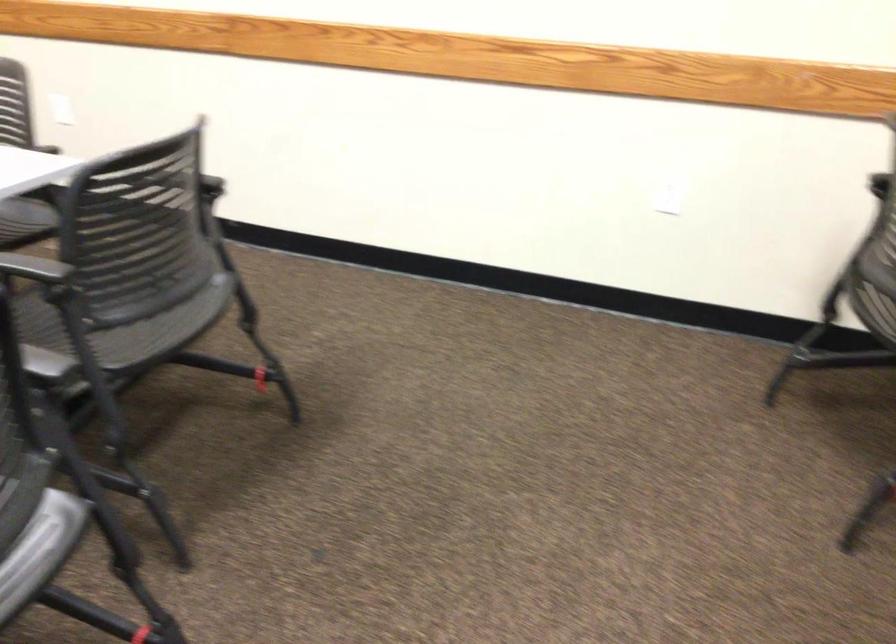
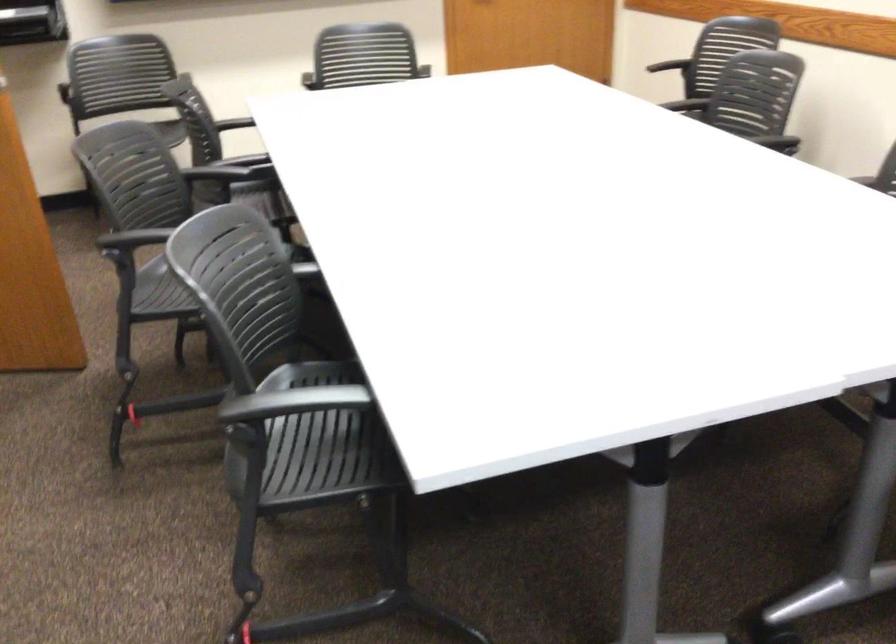
Question: The images are taken continuously from a first-person perspective. In which direction is your viewpoint rotating?

Choices:
 (A) Left
 (B) Right
 (C) Up
 (D) Down

Answer: (A)